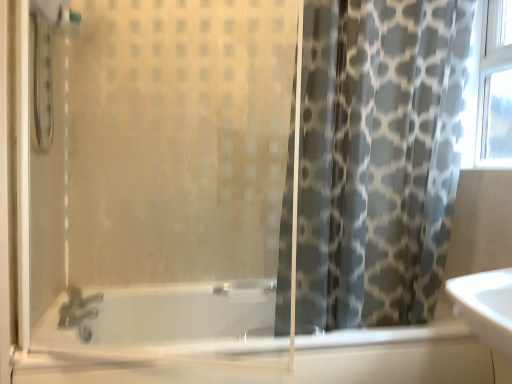
Question: From a real-world perspective, is transparent glass shower door at left positioned above or below gray fabric curtain at right?

Choices:
 (A) above
 (B) below

Answer: (B)

Question: Relative to gray fabric curtain at right, is transparent glass shower door at left in front or behind?

Choices:
 (A) behind
 (B) front

Answer: (B)

Question: Which of these objects is positioned closest to the gray fabric curtain at right?

Choices:
 (A) translucent glass bathtub at lower center
 (B) transparent glass shower door at left

Answer: (B)

Question: Estimate the real-world distances between objects in this image. Which object is farther from the translucent glass bathtub at lower center?

Choices:
 (A) transparent glass shower door at left
 (B) gray fabric curtain at right

Answer: (B)